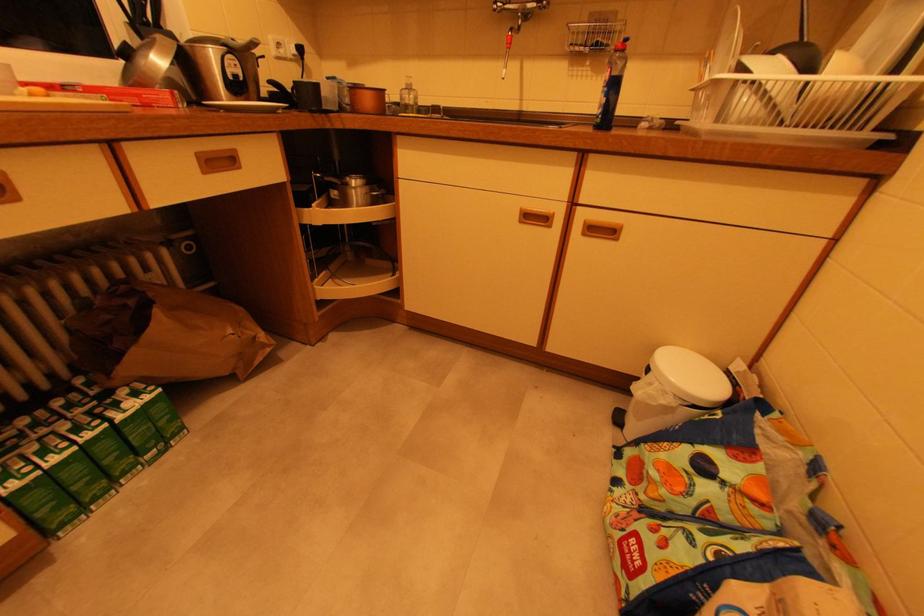
I want to click on bottle pump, so click(612, 86).